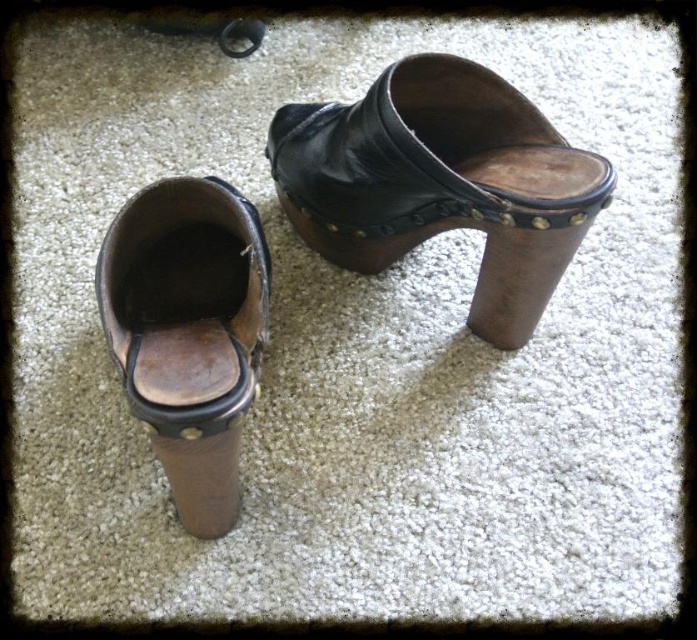
What do you see at coordinates (441, 182) in the screenshot? The image size is (697, 640). I see `black leather clog at center` at bounding box center [441, 182].

Is black leather clog at center positioned behind brown leather clog at left?

That is True.

Between point (420, 72) and point (233, 424), which one is positioned in front?

Positioned in front is point (233, 424).

Image resolution: width=697 pixels, height=640 pixels. I want to click on black leather clog at center, so click(x=441, y=182).